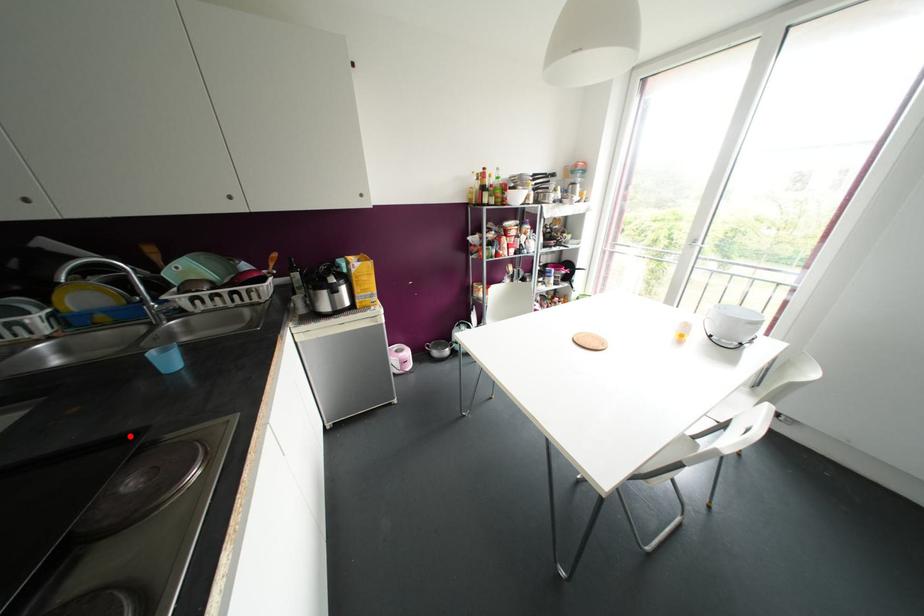
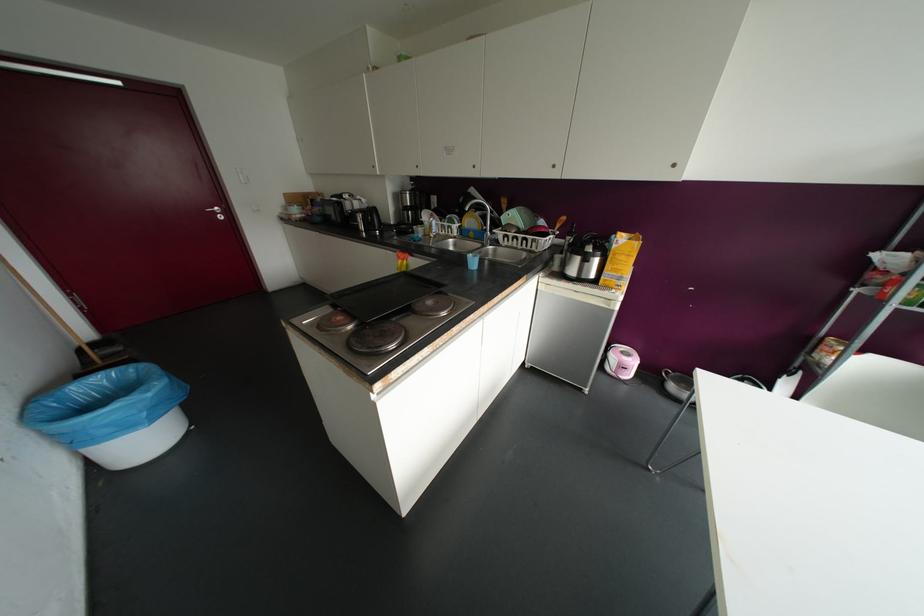
Find the pixel in the second image that matches the highlighted location in the first image.

(441, 284)